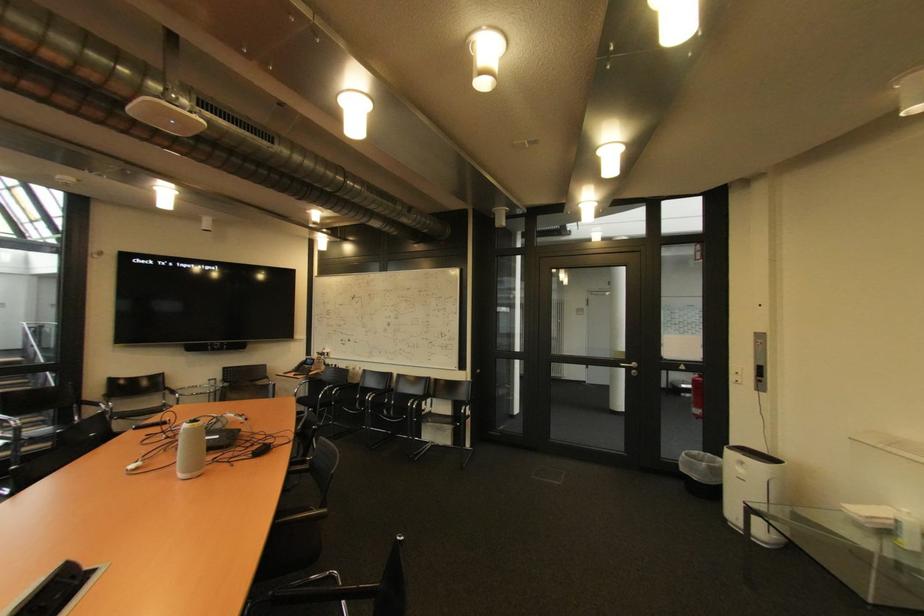
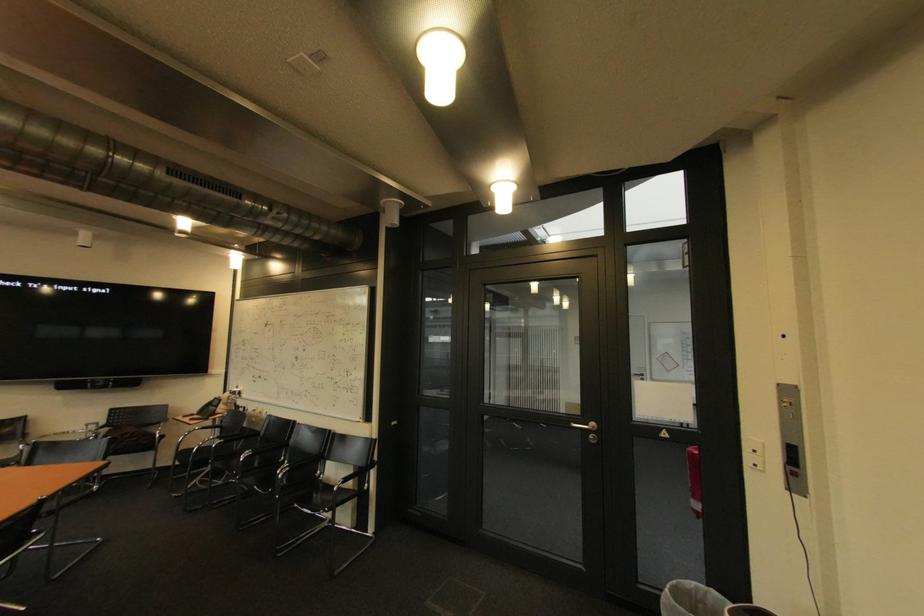
In the second image, find the point that corresponds to [382,395] in the first image.

(259, 455)